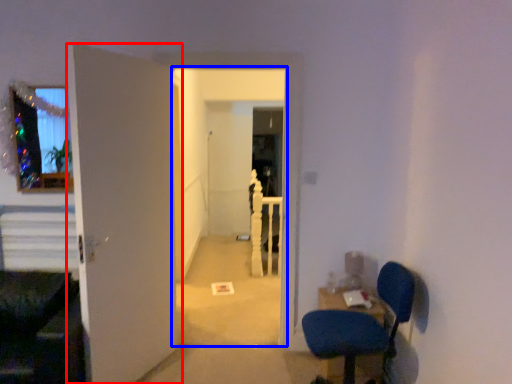
Question: Which point is further to the camera, door (highlighted by a red box) or corridor (highlighted by a blue box)?

Choices:
 (A) door
 (B) corridor

Answer: (B)